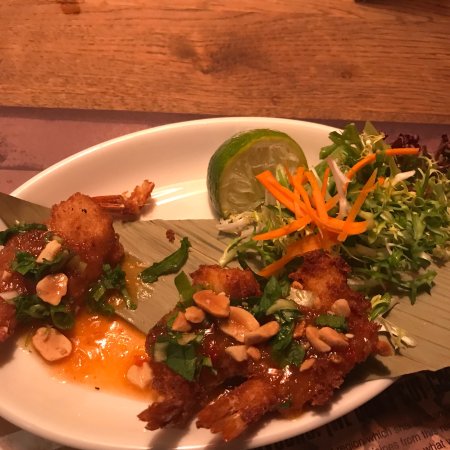
I want to click on plate bottom, so click(188, 208).